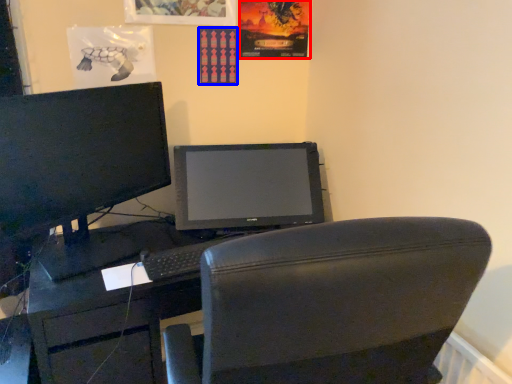
Question: Which of the following is the farthest to the observer, poster page (highlighted by a red box) or poster page (highlighted by a blue box)?

Choices:
 (A) poster page
 (B) poster page

Answer: (B)